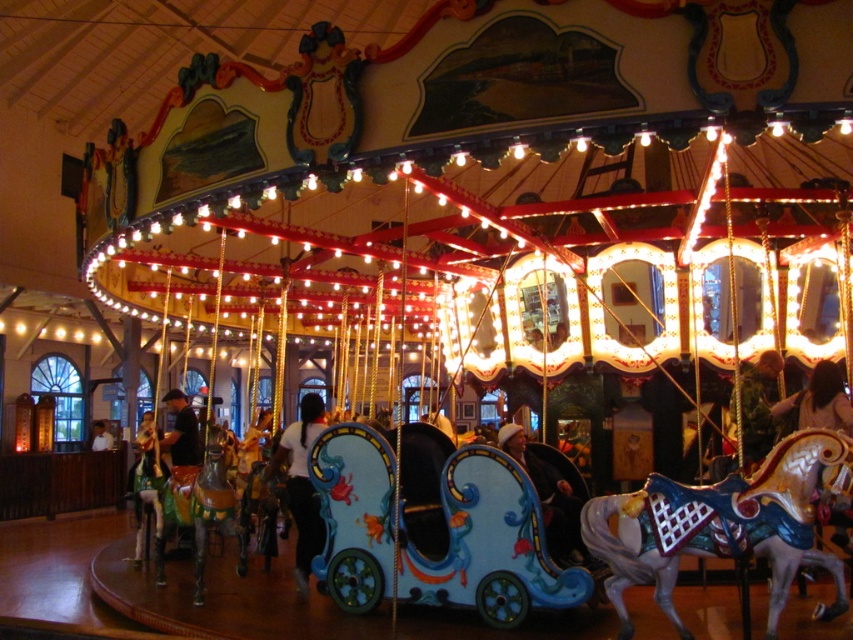
You are standing at the entrance of the carousel and want to locate the point at coordinates point (721, 525). Which object is this point located on?

The point (721, 525) is located on the shiny metallic horse at center.

You are standing in front of the carousel and want to take a photo of the shiny metallic horse at center and the shiny gold horse at center. Which horse is closer to you so that you can focus on it first?

The shiny metallic horse at center is closer to you since it is in front of the shiny gold horse at center, making it the first one you can focus on.

You are a parent trying to choose between two carousel horses for your child. The shiny metallic horse at center and the shiny gold horse at center are both available. Your child prefers the taller one. Which horse should you choose?

The shiny gold horse at center is taller than the shiny metallic horse at center, so you should choose the shiny gold horse at center.